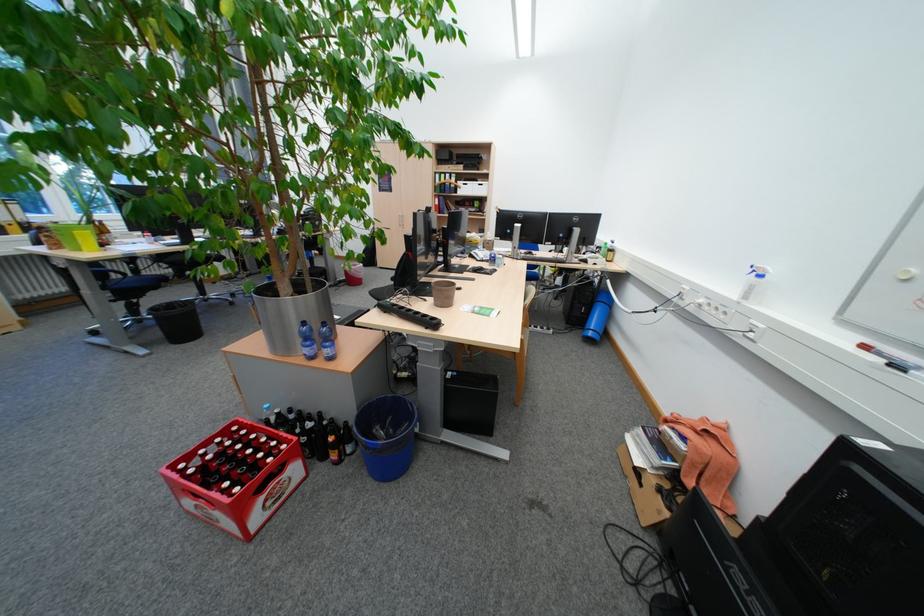
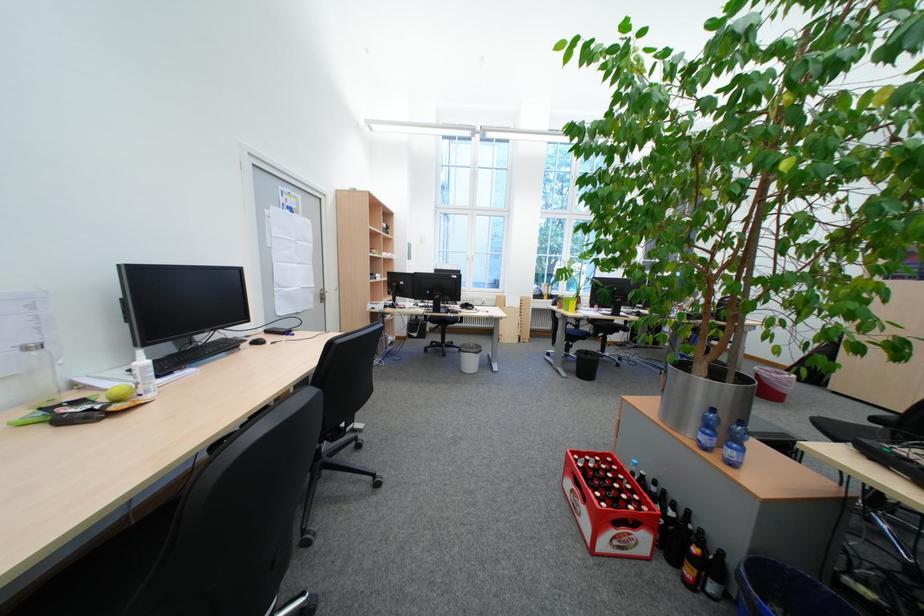
In the second image, find the point that corresponds to (156,346) in the first image.

(578, 371)